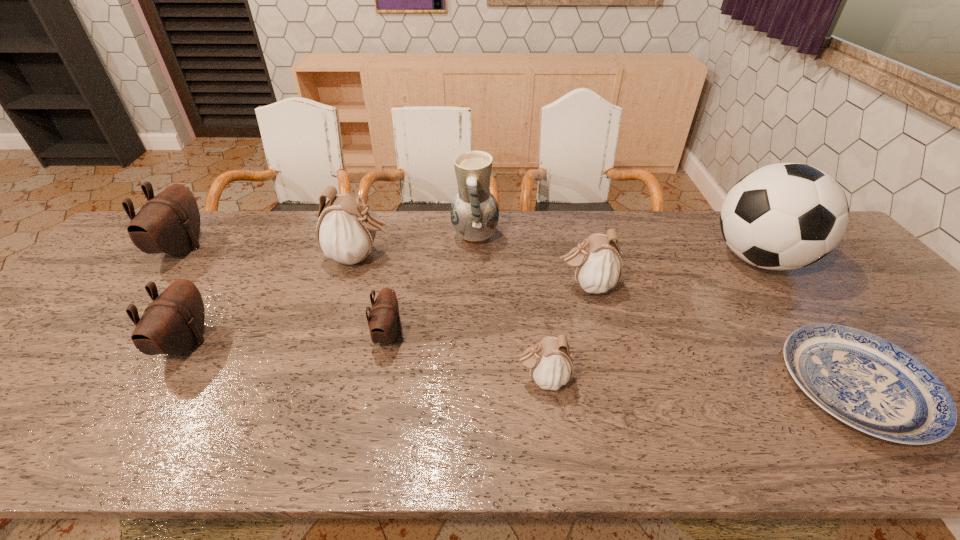
Identify the location of object that is the fourth closest to the plate. The height and width of the screenshot is (540, 960). (474, 213).

Choose which object is the nearest neighbor to the rightmost white pouch. Please provide its 2D coordinates. Your answer should be formatted as a tuple, i.e. [(x, y)], where the tuple contains the x and y coordinates of a point satisfying the conditions above.

[(474, 213)]

Locate an element on the screen. the closest pouch to the plate is located at coordinates (597, 265).

Find the location of a particular element. The height and width of the screenshot is (540, 960). pouch that is the fifth nearest to the second brown pouch from right to left is located at coordinates (597, 265).

At what (x,y) coordinates should I click in order to perform the action: click on white pouch identified as the closest to the leftmost brown pouch. Please return your answer as a coordinate pair (x, y). The height and width of the screenshot is (540, 960). Looking at the image, I should click on (346, 230).

Identify which white pouch is the nearest to the rightmost white pouch. Please provide its 2D coordinates. Your answer should be formatted as a tuple, i.e. [(x, y)], where the tuple contains the x and y coordinates of a point satisfying the conditions above.

[(550, 361)]

Find the location of `brown pouch that stands as the second closest to the seventh object from left to right`. brown pouch that stands as the second closest to the seventh object from left to right is located at coordinates coord(172,324).

Identify the location of brown pouch that is the nearest to the smallest brown pouch. This screenshot has width=960, height=540. (172, 324).

Identify the location of free spot that satisfies the following two spatial constraints: 1. with the flap open on the leftmost brown pouch; 2. on the back side of the soccer ball. This screenshot has height=540, width=960. (173, 259).

Identify the location of free spot that satisfies the following two spatial constraints: 1. with the flap open on the farthest brown pouch; 2. on the right side of the soccer ball. (173, 259).